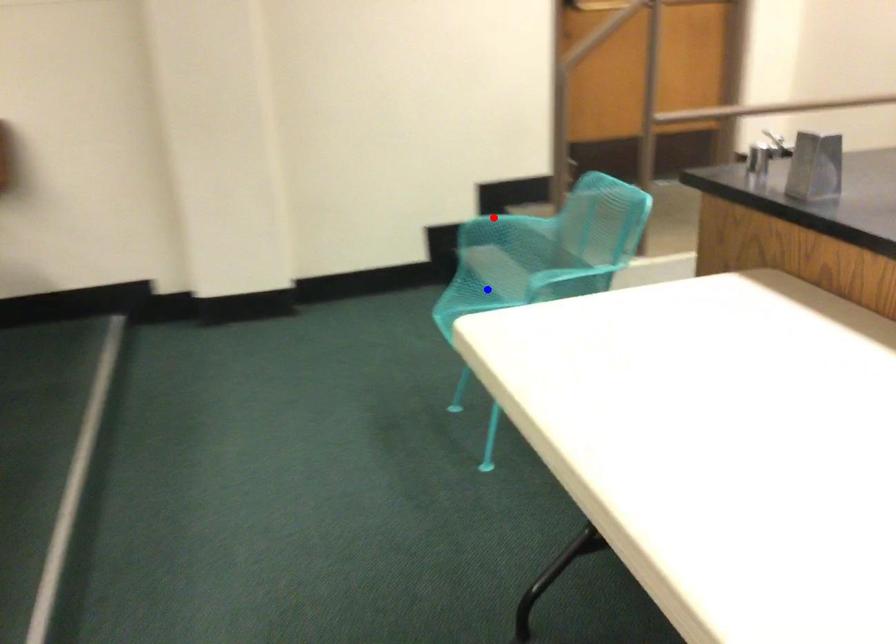
Question: Which of the two points in the image is closer to the camera?

Choices:
 (A) Blue point is closer.
 (B) Red point is closer.

Answer: (A)